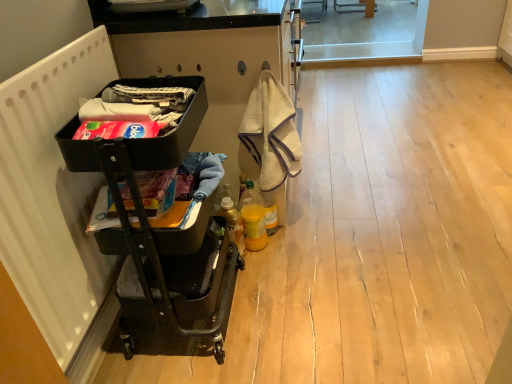
This screenshot has width=512, height=384. I want to click on free location to the right of black metal cart at left, so click(290, 294).